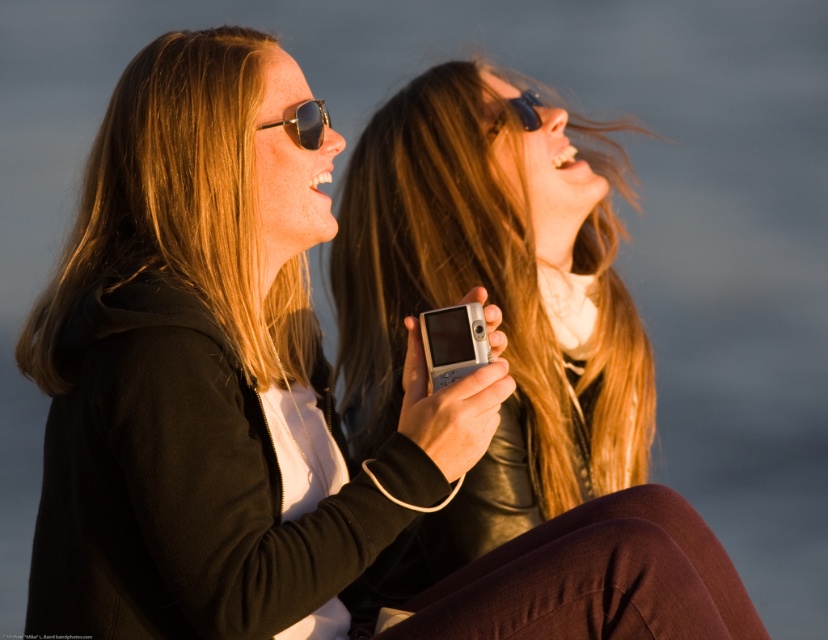
Question: Observing the image, what is the correct spatial positioning of metallic reflective sunglasses at upper center in reference to black plastic goggles at upper center?

Choices:
 (A) right
 (B) left

Answer: (B)

Question: Is metallic reflective sunglasses at upper center wider than black plastic goggles at upper center?

Choices:
 (A) yes
 (B) no

Answer: (B)

Question: Does metallic reflective sunglasses at upper center appear on the right side of black plastic goggles at upper center?

Choices:
 (A) yes
 (B) no

Answer: (B)

Question: Which point is closer to the camera?

Choices:
 (A) metallic reflective sunglasses at upper center
 (B) black plastic goggles at upper center

Answer: (A)

Question: Which object appears farthest from the camera in this image?

Choices:
 (A) metallic reflective sunglasses at upper center
 (B) black plastic goggles at upper center

Answer: (B)